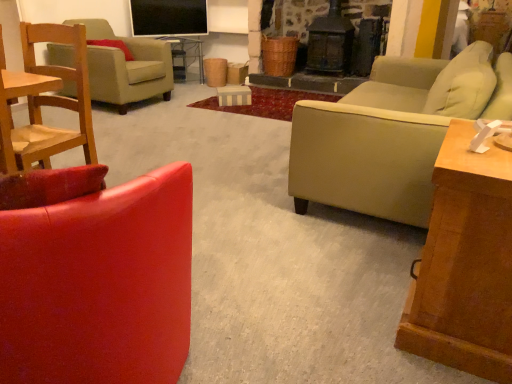
Question: From a real-world perspective, is velvet red armchair at left, the 2th chair positioned from the front, positioned above or below matte wood side table at center?

Choices:
 (A) below
 (B) above

Answer: (B)

Question: Visually, is velvet red armchair at left, the 2th chair positioned from the front, positioned to the left or to the right of matte wood side table at center?

Choices:
 (A) right
 (B) left

Answer: (B)

Question: Which of these objects is positioned closest to the wooden side table at right?

Choices:
 (A) suede-like beige pillow at upper left
 (B) velvet red armchair at left, placed as the second chair when sorted from bottom to top
 (C) beige leather couch at right
 (D) matte red leather chair at left, which is counted as the 1th chair, starting from the front
 (E) matte wood side table at center

Answer: (C)

Question: Estimate the real-world distances between objects in this image. Which object is closer to the wooden side table at right?

Choices:
 (A) matte red leather chair at left, the 1th chair from the bottom
 (B) matte green armchair at left, which is counted as the 3th chair, starting from the front
 (C) velvet red armchair at left, placed as the second chair when sorted from bottom to top
 (D) matte wood side table at center
 (E) suede-like beige pillow at upper left

Answer: (A)